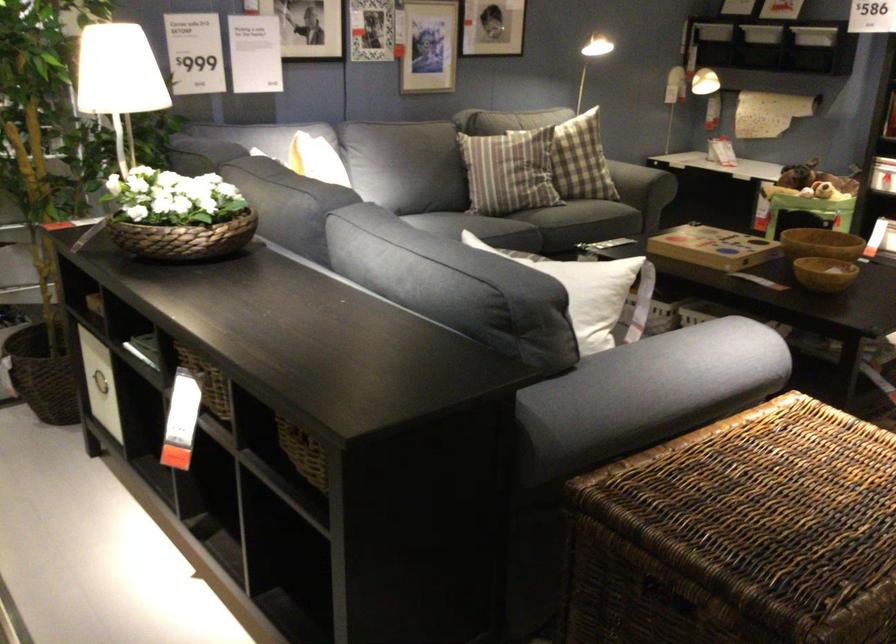
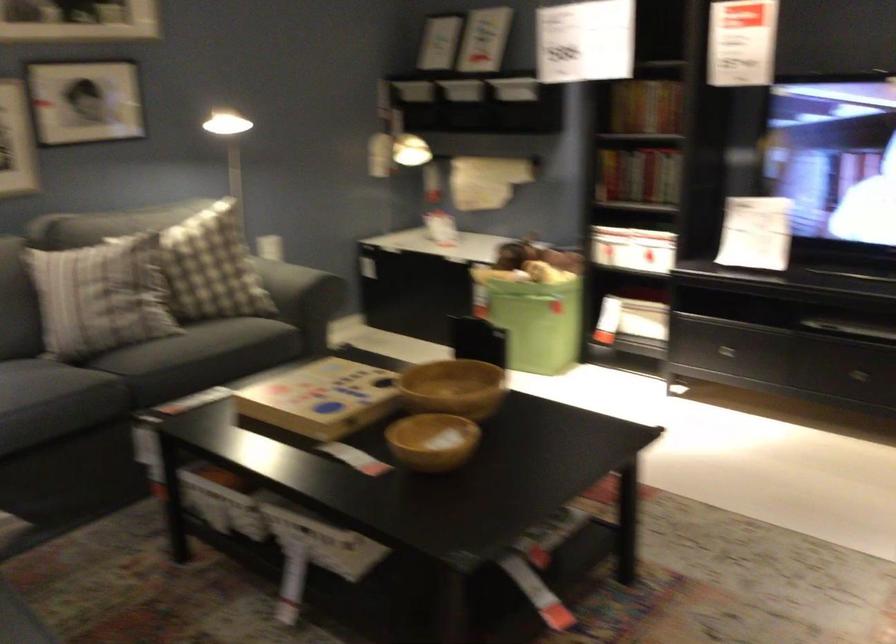
Where in the second image is the point corresponding to pixel 541 176 from the first image?

(99, 296)